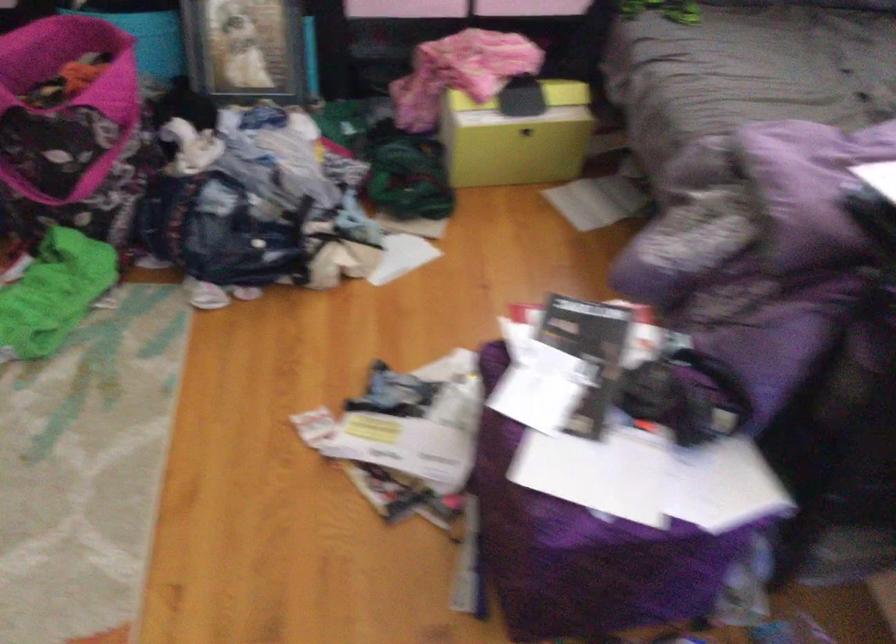
At what (x,y) coordinates should I click in order to perform the action: click on bed surface. Please return your answer as a coordinate pair (x, y). Image resolution: width=896 pixels, height=644 pixels. Looking at the image, I should click on (768, 70).